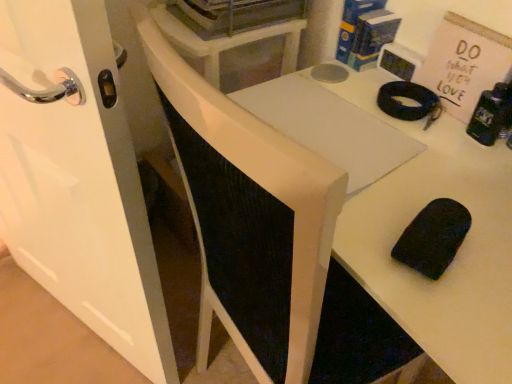
Find the location of a particular element. The image size is (512, 384). empty space that is ontop of white matte table at center is located at coordinates (389, 153).